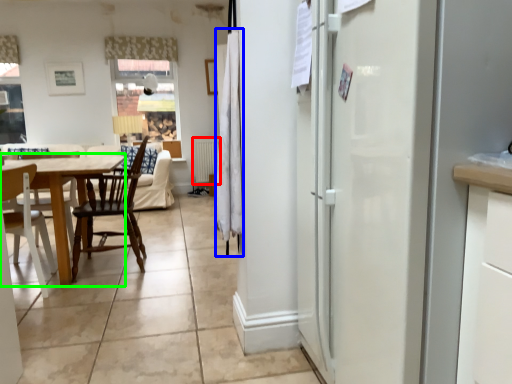
Question: Considering the real-world distances, which object is closest to radiator (highlighted by a red box)? curtain (highlighted by a blue box) or table (highlighted by a green box).

Choices:
 (A) curtain
 (B) table

Answer: (B)